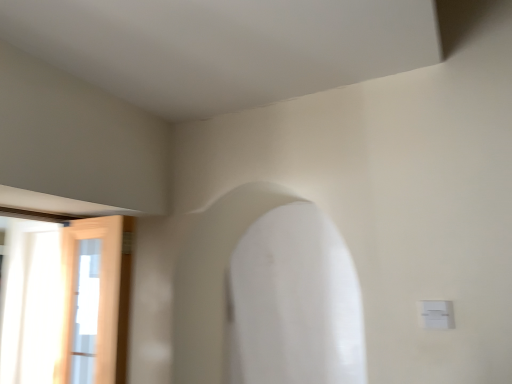
Question: Considering the positions of point (291, 221) and point (71, 355), is point (291, 221) closer or farther from the camera than point (71, 355)?

Choices:
 (A) closer
 (B) farther

Answer: (B)

Question: Considering the positions of white smooth archway at center and wooden door at left in the image, is white smooth archway at center bigger or smaller than wooden door at left?

Choices:
 (A) small
 (B) big

Answer: (B)

Question: Based on their relative distances, which object is nearer to the white smooth archway at center?

Choices:
 (A) wooden door at left
 (B) white plastic electric outlet at lower right

Answer: (A)

Question: Estimate the real-world distances between objects in this image. Which object is closer to the white smooth archway at center?

Choices:
 (A) white plastic electric outlet at lower right
 (B) wooden door at left

Answer: (B)